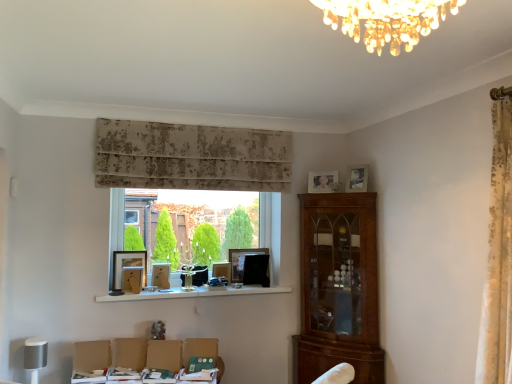
Find the location of a particular element. The image size is (512, 384). vacant space situated above beige textured curtain at upper center (from a real-world perspective) is located at coordinates (188, 126).